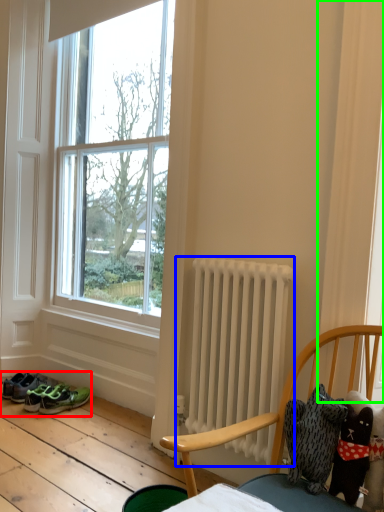
Question: Which object is the farthest from footwear (highlighted by a red box)? Choose among these: radiator (highlighted by a blue box) or curtain (highlighted by a green box).

Choices:
 (A) radiator
 (B) curtain

Answer: (B)